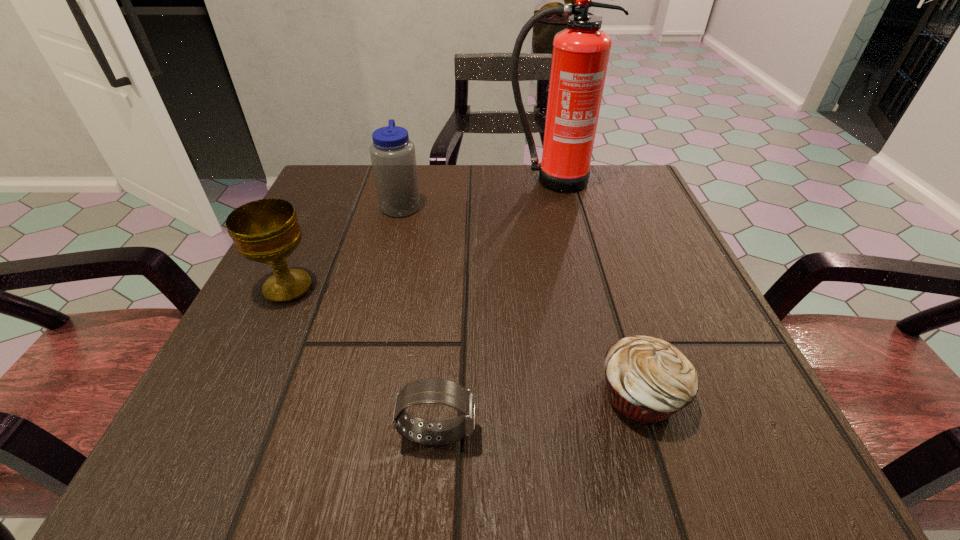
Where is `fire extinguisher`? This screenshot has height=540, width=960. fire extinguisher is located at coordinates (580, 55).

Locate an element on the screen. water bottle is located at coordinates point(393,158).

I want to click on the third farthest object, so click(x=267, y=231).

Find the location of a particular element. The image size is (960, 540). the leftmost object is located at coordinates (267, 231).

This screenshot has height=540, width=960. I want to click on the third object from right to left, so click(x=440, y=391).

At what (x,y) coordinates should I click in order to perform the action: click on muffin. Please return your answer as a coordinate pair (x, y). Looking at the image, I should click on (647, 379).

What are the coordinates of `free space located at the nozzle of the fire extinguisher` in the screenshot? It's located at (577, 291).

The image size is (960, 540). I want to click on free region located with a carrying loop on the side of the second object from left to right, so click(562, 205).

Image resolution: width=960 pixels, height=540 pixels. I want to click on vacant space located 0.340m on the back of the leftmost object, so click(x=341, y=173).

Find the location of a particular element. The image size is (960, 540). vacant space located on the face of the watch is located at coordinates (714, 433).